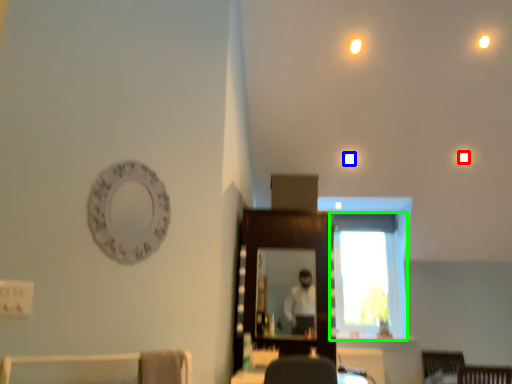
Question: Based on their relative distances, which object is nearer to lighting (highlighted by a red box)? Choose from light (highlighted by a blue box) and window (highlighted by a green box).

Choices:
 (A) light
 (B) window

Answer: (A)